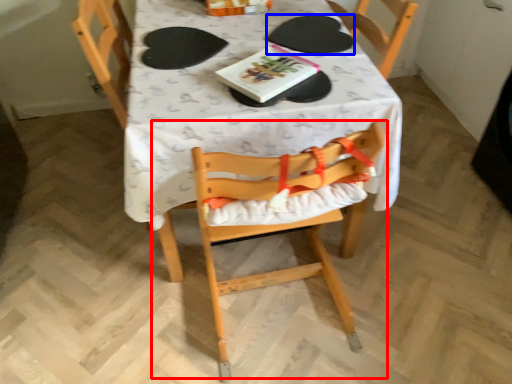
Question: Which point is closer to the camera, chair (highlighted by a red box) or paper plate (highlighted by a blue box)?

Choices:
 (A) chair
 (B) paper plate

Answer: (A)